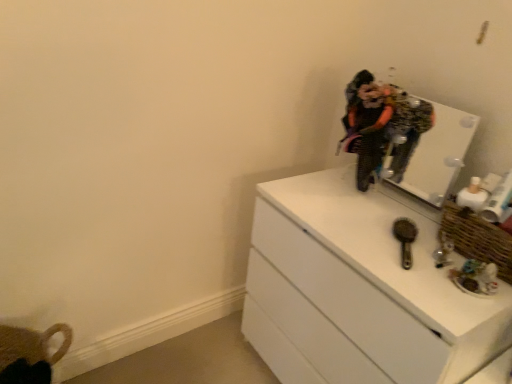
Where is `vacant area located to the right-hand side of metallic brown brush at center-right`? This screenshot has height=384, width=512. vacant area located to the right-hand side of metallic brown brush at center-right is located at coordinates (437, 253).